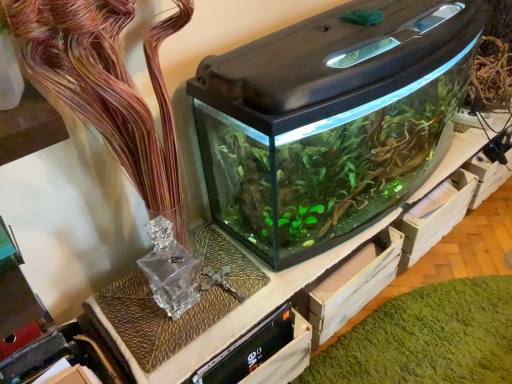
Question: Considering the relative sizes of translucent glass vase at upper center and green matte algae at center in the image provided, is translucent glass vase at upper center thinner than green matte algae at center?

Choices:
 (A) yes
 (B) no

Answer: (A)

Question: Can you confirm if translucent glass vase at upper center is smaller than green matte algae at center?

Choices:
 (A) no
 (B) yes

Answer: (A)

Question: From the image's perspective, is translucent glass vase at upper center located beneath green matte algae at center?

Choices:
 (A) no
 (B) yes

Answer: (A)

Question: Considering the relative positions of translucent glass vase at upper center and green matte algae at center in the image provided, is translucent glass vase at upper center behind green matte algae at center?

Choices:
 (A) yes
 (B) no

Answer: (B)

Question: Is translucent glass vase at upper center not near green matte algae at center?

Choices:
 (A) yes
 (B) no

Answer: (B)

Question: Is point (500, 322) closer or farther from the camera than point (143, 134)?

Choices:
 (A) farther
 (B) closer

Answer: (A)

Question: From their relative heights in the image, would you say green matte algae at center is taller or shorter than translucent glass vase at upper center?

Choices:
 (A) short
 (B) tall

Answer: (A)

Question: From a real-world perspective, relative to translucent glass vase at upper center, is green matte algae at center vertically above or below?

Choices:
 (A) below
 (B) above

Answer: (A)

Question: Considering the positions of green matte algae at center and translucent glass vase at upper center in the image, is green matte algae at center wider or thinner than translucent glass vase at upper center?

Choices:
 (A) wide
 (B) thin

Answer: (A)

Question: Looking at the image, does transparent glass aquarium at center seem bigger or smaller compared to green matte algae at center?

Choices:
 (A) small
 (B) big

Answer: (B)

Question: From a real-world perspective, relative to green matte algae at center, is transparent glass aquarium at center vertically above or below?

Choices:
 (A) below
 (B) above

Answer: (B)

Question: Considering the relative positions of transparent glass aquarium at center and green matte algae at center in the image provided, is transparent glass aquarium at center to the left or to the right of green matte algae at center?

Choices:
 (A) left
 (B) right

Answer: (A)

Question: Which is correct: transparent glass aquarium at center is inside green matte algae at center, or outside of it?

Choices:
 (A) inside
 (B) outside

Answer: (B)

Question: Is transparent glass aquarium at center wider or thinner than translucent glass vase at upper center?

Choices:
 (A) wide
 (B) thin

Answer: (A)

Question: From a real-world perspective, is transparent glass aquarium at center physically located above or below translucent glass vase at upper center?

Choices:
 (A) below
 (B) above

Answer: (A)